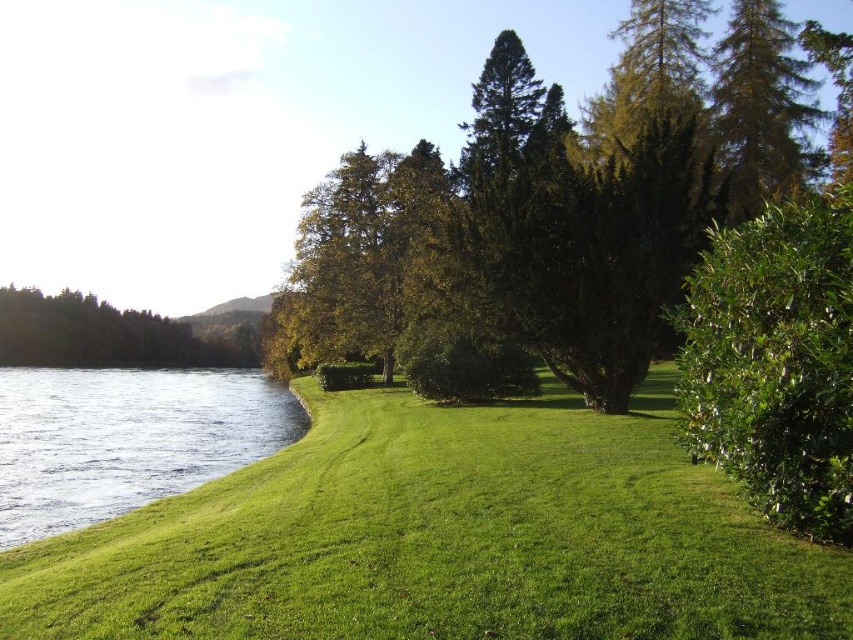
Based on the photo, between green leafy tree at center and green leafy bush at right, which one appears on the right side from the viewer's perspective?

green leafy bush at right

Does green leafy tree at center have a larger size compared to green leafy bush at right?

Yes.

Locate an element on the screen. The width and height of the screenshot is (853, 640). green leafy tree at center is located at coordinates (553, 205).

Is green leafy tree at center below clear water at lower left?

No, green leafy tree at center is not below clear water at lower left.

Looking at this image, between green leafy tree at center and clear water at lower left, which one has less height?

clear water at lower left is shorter.

Describe the element at coordinates (553, 205) in the screenshot. I see `green leafy tree at center` at that location.

What are the coordinates of `green leafy tree at center` in the screenshot? It's located at (553, 205).

Consider the image. Who is taller, clear water at lower left or green needle-like at upper right?

Standing taller between the two is green needle-like at upper right.

This screenshot has width=853, height=640. Describe the element at coordinates (126, 438) in the screenshot. I see `clear water at lower left` at that location.

Between point (19, 445) and point (793, 28), which one is positioned behind?

The point (793, 28) is behind.

The width and height of the screenshot is (853, 640). Identify the location of clear water at lower left. (126, 438).